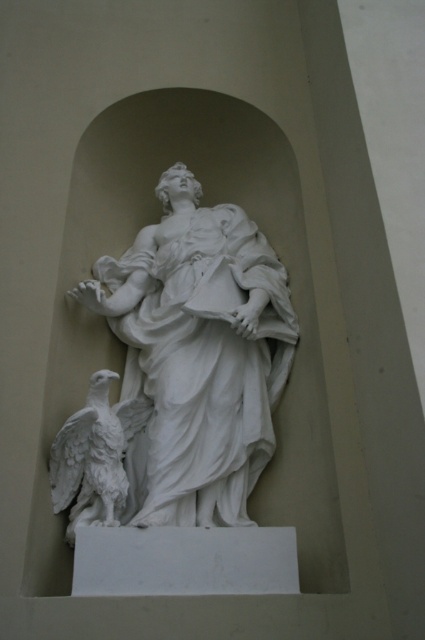
You are standing in front of the alcove and want to locate the white marble statue at center. What are its coordinates in the image?

The white marble statue at center is located at coordinates point (198, 355).

You are an art conservator standing at the camera position. You need to measure the distance between the white marble statue at center and the sculpted eagle on the left. Can you estimate how far apart they are?

The white marble statue at center is 43.93 meters from camera, but the distance between the white marble statue at center and the sculpted eagle on the left cannot be determined with the given information.